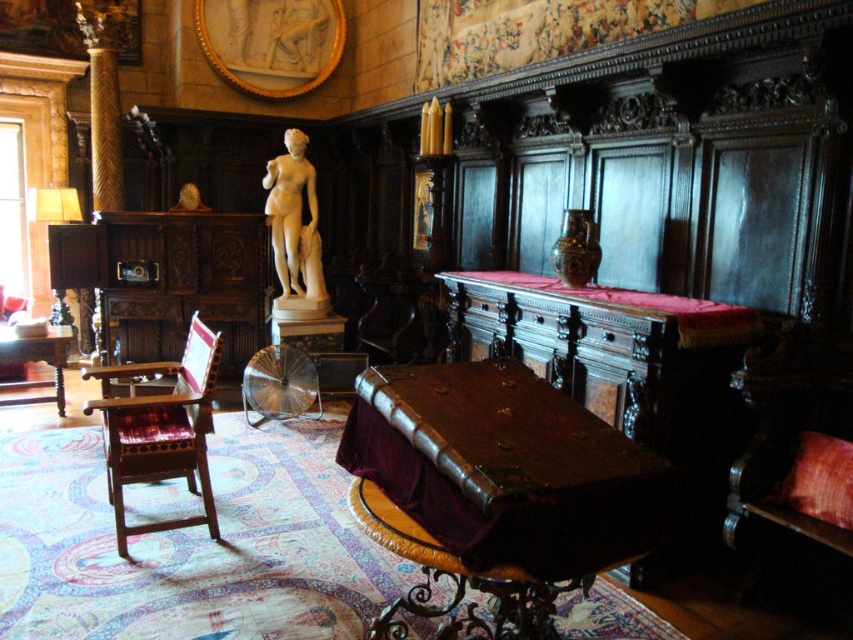
This screenshot has width=853, height=640. Describe the element at coordinates (498, 490) in the screenshot. I see `leather-bound trunk at center` at that location.

I want to click on leather-bound trunk at center, so click(x=498, y=490).

Can you confirm if wooden woven armchair at left is thinner than white marble statue at center?

In fact, wooden woven armchair at left might be wider than white marble statue at center.

Identify the location of wooden woven armchair at left. (160, 429).

Does point (109, 410) lie in front of point (311, 172)?

Yes, it is.

Find the location of a particular element. The width and height of the screenshot is (853, 640). wooden woven armchair at left is located at coordinates (160, 429).

Can you confirm if velvet red armchair at right is thinner than white marble statue at center?

No, velvet red armchair at right is not thinner than white marble statue at center.

In the scene shown: Between velvet red armchair at right and white marble statue at center, which one has less height?

velvet red armchair at right is shorter.

Where is `velvet red armchair at right`? Image resolution: width=853 pixels, height=640 pixels. velvet red armchair at right is located at coordinates (793, 461).

You are a GUI agent. You are given a task and a screenshot of the screen. Output one action in this format:
    pyautogui.click(x=<x>, y=<y>)
    Task: Click on the velvet red armchair at right
    The height and width of the screenshot is (640, 853).
    Given the screenshot: What is the action you would take?
    pyautogui.click(x=793, y=461)